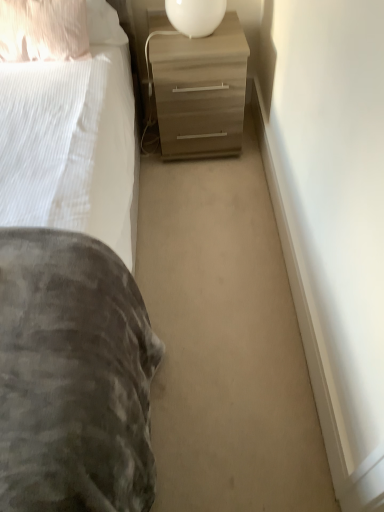
Question: Is white glossy table lamp at upper center oriented towards matte wood chest of drawers at center?

Choices:
 (A) yes
 (B) no

Answer: (B)

Question: Is matte wood chest of drawers at center surrounded by white glossy table lamp at upper center?

Choices:
 (A) yes
 (B) no

Answer: (B)

Question: Is the depth of white glossy table lamp at upper center greater than that of matte wood chest of drawers at center?

Choices:
 (A) yes
 (B) no

Answer: (B)

Question: Can you confirm if white glossy table lamp at upper center is thinner than matte wood chest of drawers at center?

Choices:
 (A) no
 (B) yes

Answer: (B)

Question: Would you say white glossy table lamp at upper center is outside matte wood chest of drawers at center?

Choices:
 (A) no
 (B) yes

Answer: (B)

Question: Looking at the image, does pillow at upper left seem bigger or smaller compared to matte wood chest of drawers at center?

Choices:
 (A) big
 (B) small

Answer: (B)

Question: Is pillow at upper left wider or thinner than matte wood chest of drawers at center?

Choices:
 (A) thin
 (B) wide

Answer: (A)

Question: Is pillow at upper left in front of or behind matte wood chest of drawers at center in the image?

Choices:
 (A) behind
 (B) front

Answer: (B)

Question: In terms of height, does pillow at upper left look taller or shorter compared to matte wood chest of drawers at center?

Choices:
 (A) tall
 (B) short

Answer: (B)

Question: Is white glossy table lamp at upper center situated inside matte wood chest of drawers at center or outside?

Choices:
 (A) inside
 (B) outside

Answer: (B)

Question: Is point (201, 33) positioned closer to the camera than point (213, 154)?

Choices:
 (A) farther
 (B) closer

Answer: (B)

Question: From a real-world perspective, is white glossy table lamp at upper center physically located above or below matte wood chest of drawers at center?

Choices:
 (A) above
 (B) below

Answer: (A)

Question: From the image's perspective, is white glossy table lamp at upper center located above or below matte wood chest of drawers at center?

Choices:
 (A) above
 (B) below

Answer: (A)

Question: Is white glossy table lamp at upper center spatially inside pillow at upper left, or outside of it?

Choices:
 (A) inside
 (B) outside

Answer: (B)

Question: Would you say white glossy table lamp at upper center is to the left or to the right of pillow at upper left in the picture?

Choices:
 (A) left
 (B) right

Answer: (B)